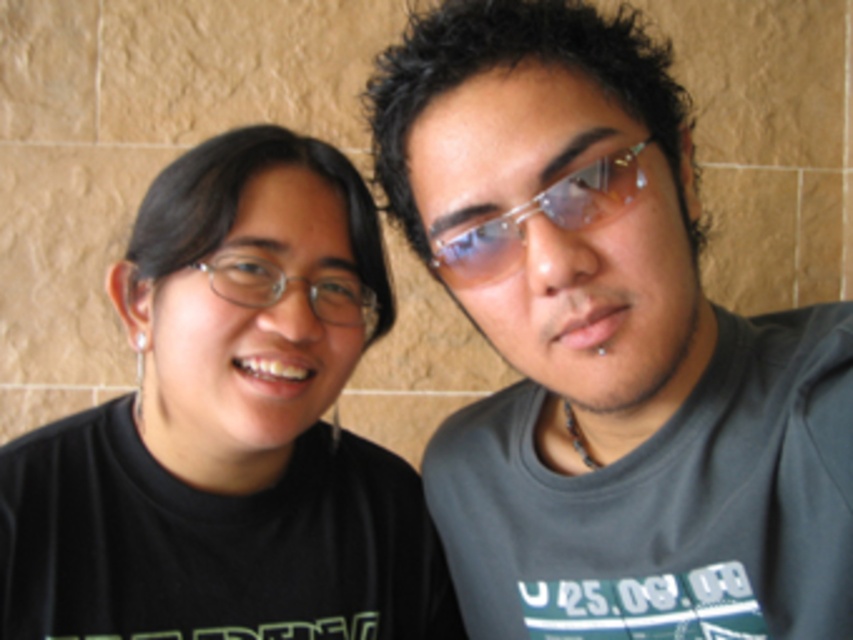
Question: Does black matte glasses at left appear on the left side of clear plastic glasses at center?

Choices:
 (A) yes
 (B) no

Answer: (A)

Question: Which point is closer to the camera taking this photo?

Choices:
 (A) (546, 68)
 (B) (344, 284)

Answer: (A)

Question: Does sunglasses at center have a lesser width compared to clear plastic glasses at center?

Choices:
 (A) yes
 (B) no

Answer: (A)

Question: Among these points, which one is nearest to the camera?

Choices:
 (A) (44, 624)
 (B) (619, 164)
 (C) (241, 301)
 (D) (509, 410)

Answer: (B)

Question: Which point appears farthest from the camera in this image?

Choices:
 (A) (368, 326)
 (B) (590, 224)
 (C) (102, 410)

Answer: (C)

Question: Considering the relative positions of gray matte t-shirt at right and sunglasses at center in the image provided, where is gray matte t-shirt at right located with respect to sunglasses at center?

Choices:
 (A) left
 (B) right

Answer: (B)